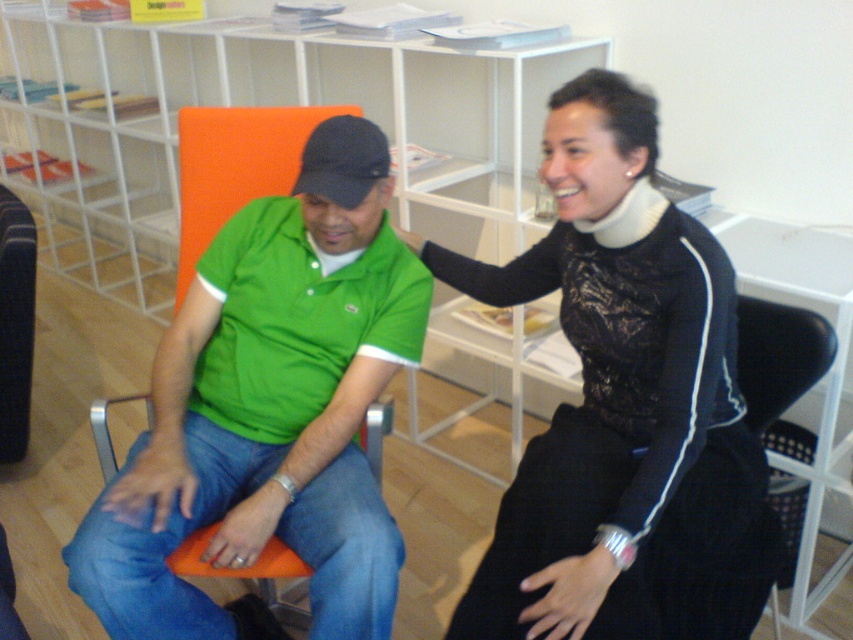
Question: From the image, what is the correct spatial relationship of black lace top at center in relation to white foam neckband at upper center?

Choices:
 (A) above
 (B) below

Answer: (B)

Question: Based on their relative distances, which object is nearer to the black lace top at center?

Choices:
 (A) green polo shirt at center
 (B) white foam neckband at upper center

Answer: (B)

Question: Is green polo shirt at center thinner than white foam neckband at upper center?

Choices:
 (A) no
 (B) yes

Answer: (A)

Question: Is black lace top at center further to the viewer compared to green polo shirt at center?

Choices:
 (A) no
 (B) yes

Answer: (A)

Question: Which object is positioned farthest from the black lace top at center?

Choices:
 (A) green polo shirt at center
 (B) white foam neckband at upper center

Answer: (A)

Question: Which point is farther to the camera?

Choices:
 (A) (659, 212)
 (B) (708, 241)
 (C) (291, 516)

Answer: (C)